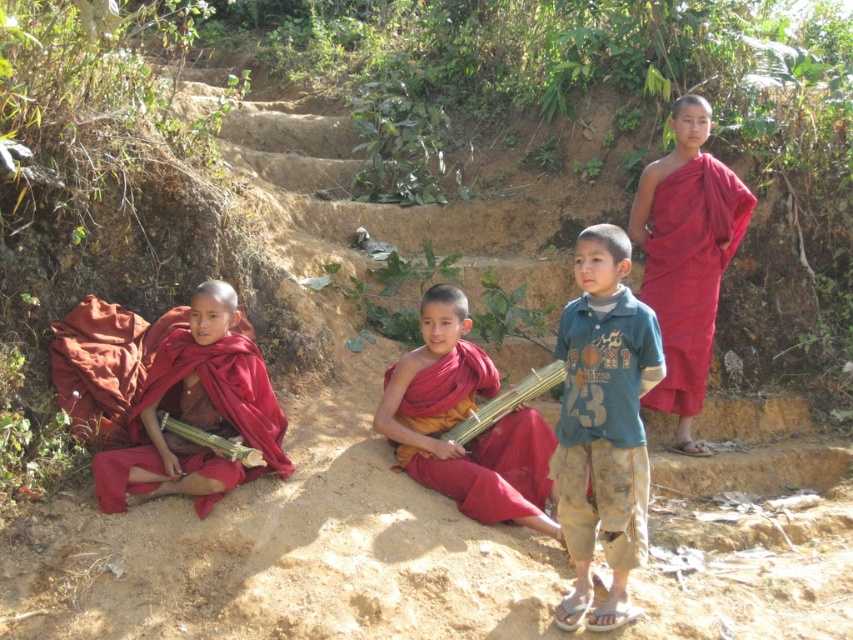
Question: Considering the real-world distances, which object is farthest from the matte red robe at upper right?

Choices:
 (A) blue cotton shirt at center
 (B) matte red robe at center

Answer: (A)

Question: Considering the real-world distances, which object is closest to the blue cotton shirt at center?

Choices:
 (A) matte red robe at center
 (B) matte red robe at lower left

Answer: (A)

Question: Can you confirm if matte red robe at upper right is wider than matte red robe at lower left?

Choices:
 (A) no
 (B) yes

Answer: (A)

Question: Among these points, which one is nearest to the camera?

Choices:
 (A) (229, 342)
 (B) (636, 499)
 (C) (437, 417)
 (D) (706, 349)

Answer: (B)

Question: Does matte red robe at upper right appear over matte red robe at lower left?

Choices:
 (A) yes
 (B) no

Answer: (A)

Question: Is blue cotton shirt at center below matte red robe at center?

Choices:
 (A) no
 (B) yes

Answer: (A)